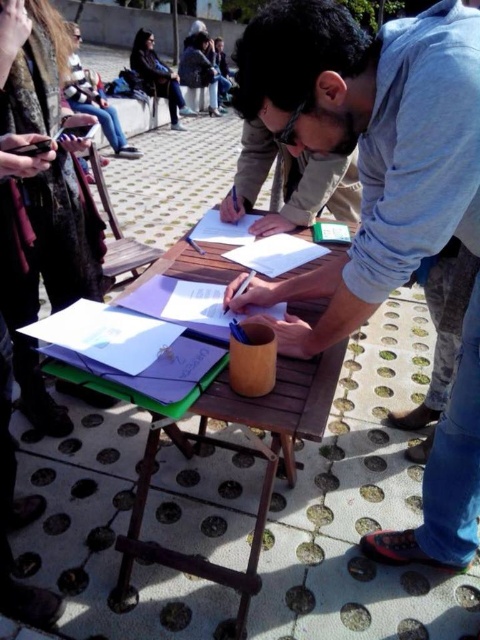
The height and width of the screenshot is (640, 480). What do you see at coordinates (369, 144) in the screenshot?
I see `matte blue shirt at center` at bounding box center [369, 144].

Measure the distance between point (312, 337) and camera.

A distance of 3.63 feet exists between point (312, 337) and camera.

You are a GUI agent. You are given a task and a screenshot of the screen. Output one action in this format:
    pyautogui.click(x=<x>, y=<y>)
    Task: Click on the matte blue shirt at center
    The height and width of the screenshot is (640, 480).
    Given the screenshot: What is the action you would take?
    (369, 144)

Does matte blue shirt at center have a greater width compared to wooden picnic table at center?

Incorrect, matte blue shirt at center's width does not surpass wooden picnic table at center's.

Is matte blue shirt at center positioned behind wooden picnic table at center?

No, it is in front of wooden picnic table at center.

Does point (308, 70) come closer to viewer compared to point (103, 388)?

That is True.

The height and width of the screenshot is (640, 480). What are the coordinates of `matte blue shirt at center` in the screenshot? It's located at (369, 144).

From the picture: Between wooden picnic table at center and matte black jacket at upper left, which one is positioned higher?

matte black jacket at upper left is above.

Does point (192, 477) come closer to viewer compared to point (166, 84)?

Yes, it is in front of point (166, 84).

Between point (272, 428) and point (145, 54), which one is positioned behind?

Point (145, 54)

Identify the location of wooden picnic table at center. The width and height of the screenshot is (480, 640). (232, 458).